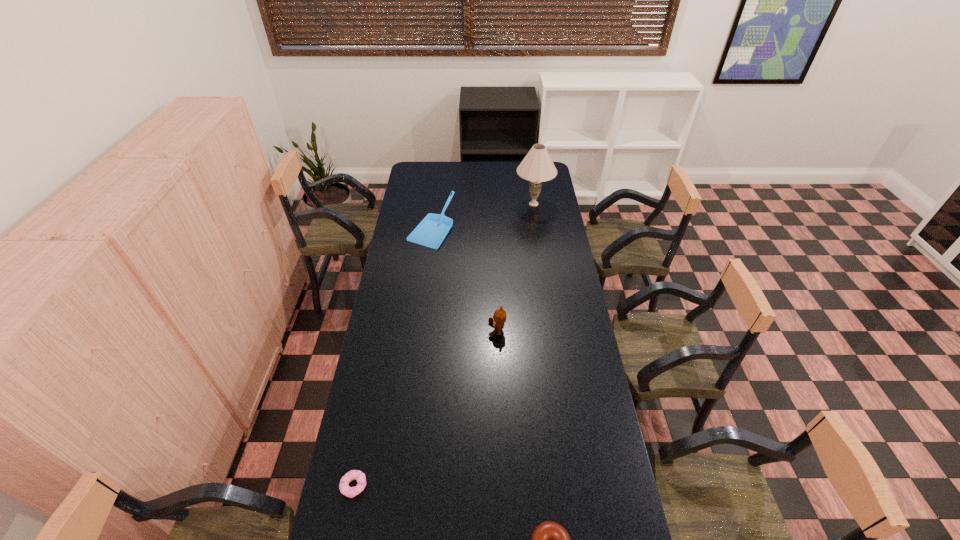
Find the location of a particular element. The height and width of the screenshot is (540, 960). free space between the left doughnut and the tallest object is located at coordinates (444, 345).

This screenshot has height=540, width=960. I want to click on the closest object to the third object from left to right, so click(x=432, y=230).

This screenshot has width=960, height=540. Find the location of `object that is the closest to the second nearest object`. object that is the closest to the second nearest object is located at coordinates (549, 539).

Find the location of a particular element. free space that satisfies the following two spatial constraints: 1. on the back side of the lampshade; 2. on the right side of the dustpan is located at coordinates [x=435, y=204].

What are the coordinates of `free spot that satisfies the following two spatial constraints: 1. on the back side of the dustpan; 2. on the left side of the lampshade` in the screenshot? It's located at [435, 204].